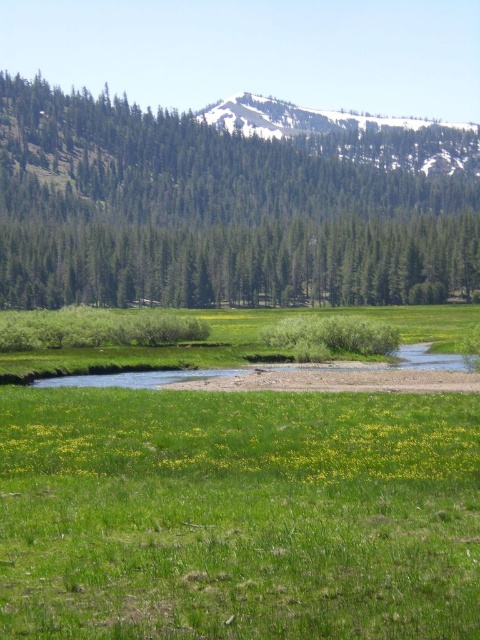
Looking at this image, you are standing at the center of the image and want to find the green textured trees at left. According to the coordinates provided, in which direction should you look to locate them?

The green textured trees at left are located at coordinates point (212, 212), which means they are positioned to the left of the center point. Therefore, you should look to the left direction to locate them.